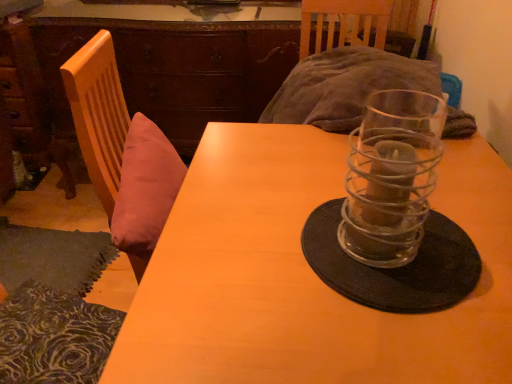
Question: From the image's perspective, is wooden table at center positioned above or below brown wood dresser at upper left?

Choices:
 (A) above
 (B) below

Answer: (B)

Question: From a real-world perspective, is wooden table at center above or below brown wood dresser at upper left?

Choices:
 (A) above
 (B) below

Answer: (B)

Question: Estimate the real-world distances between objects in this image. Which object is closer to the brown wood dresser at upper left?

Choices:
 (A) clear glass candle holder at center
 (B) black matte glass plate at center
 (C) wooden table at center

Answer: (C)

Question: Which object is the farthest from the black matte glass plate at center?

Choices:
 (A) clear glass candle holder at center
 (B) brown wood dresser at upper left
 (C) wooden table at center

Answer: (B)